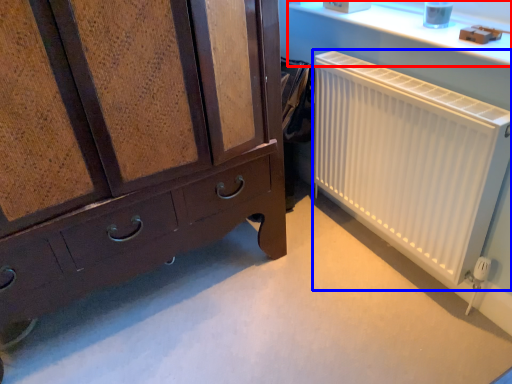
Question: Which object is further to the camera taking this photo, window sill (highlighted by a red box) or radiator (highlighted by a blue box)?

Choices:
 (A) window sill
 (B) radiator

Answer: (A)